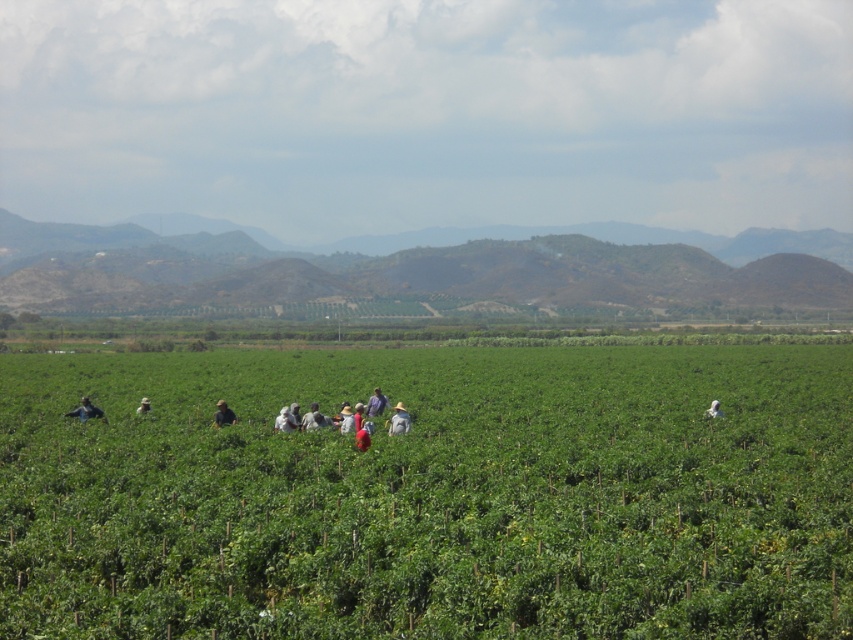
You are a photographer planning to capture a photo of the dark blue shirt at lower left and the purple fabric at center in the agricultural field scene. Which object should you focus on first if you want to include both in your frame without adjusting your camera settings?

You should focus on the dark blue shirt at lower left first because it is larger in size compared to the purple fabric at center, ensuring it is in clear view before adjusting for the smaller object.